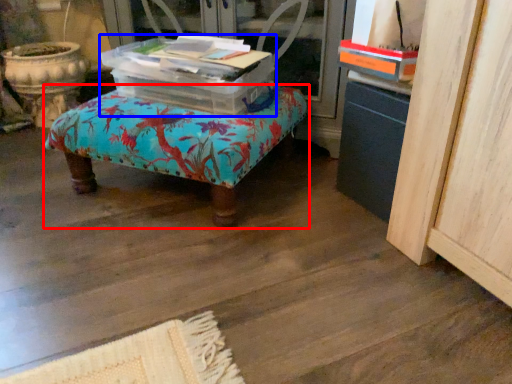
Question: Which object is further to the camera taking this photo, furniture (highlighted by a red box) or storage box (highlighted by a blue box)?

Choices:
 (A) furniture
 (B) storage box

Answer: (B)